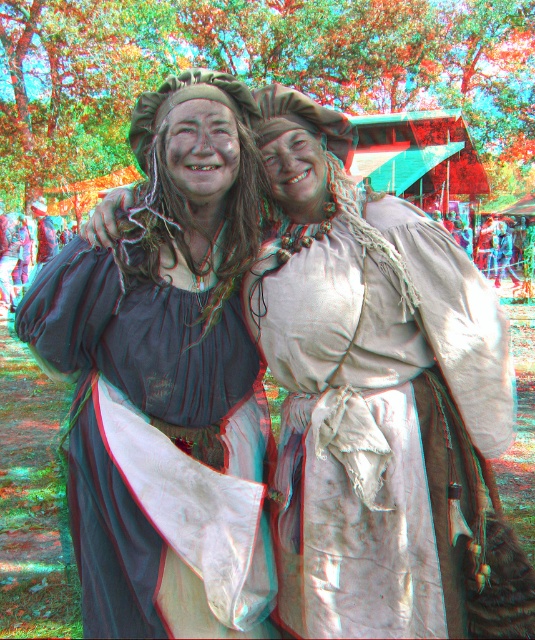
Does matte beige dress at center have a smaller size compared to matte black dress at center?

No.

Does matte beige dress at center have a lesser height compared to matte black dress at center?

Incorrect, matte beige dress at center's height does not fall short of matte black dress at center's.

Between point (323, 480) and point (226, 268), which one is positioned in front?

Point (323, 480)

Find the location of `matte beige dress at center`. matte beige dress at center is located at coordinates (378, 401).